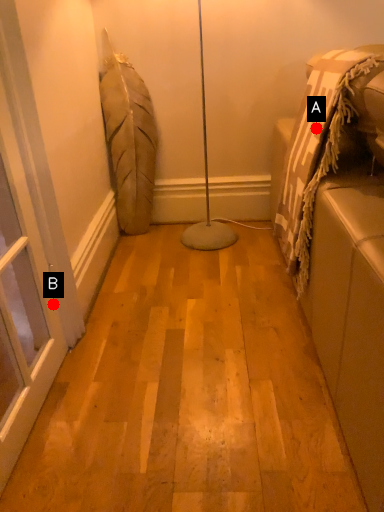
Question: Two points are circled on the image, labeled by A and B beside each circle. Which point is farther to the camera?

Choices:
 (A) A is further
 (B) B is further

Answer: (A)